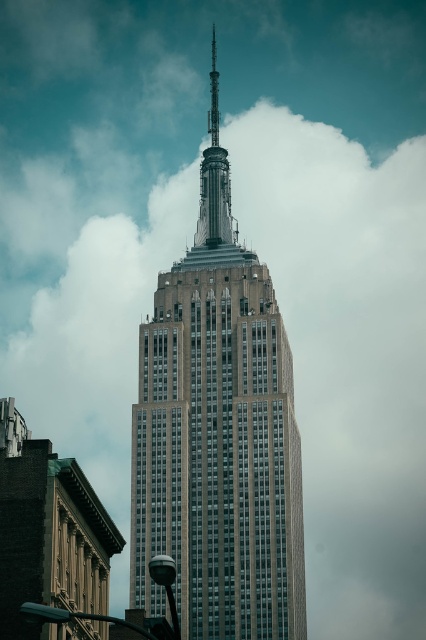
You are an architect evaluating the Empire State Building. You notice the gray stone tower at center and the polished silver spire at center. Which one has a greater height?

The gray stone tower at center has a larger size compared to the polished silver spire at center, so the gray stone tower at center is taller.

You are an architect observing the Empire State Building. You notice the gray stone tower at center and the polished silver spire at center. Which object is positioned higher in the image?

The polished silver spire at center is positioned higher than the gray stone tower at center because it is located above it.

You are standing in front of the Empire State Building and want to take a photo that includes both the gray stone tower at center and the polished silver spire at center. Which object should you position to the left side of your camera frame to ensure both are visible?

You should position the gray stone tower at center to the left side of your camera frame because it is already located to the left of the polished silver spire at center, ensuring both are included in the photo.